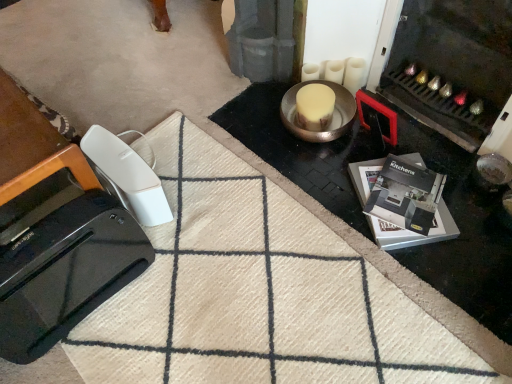
Question: Considering the relative sizes of beige woolen doormat at lower left and white plastic remote at lower left, marked as the second home appliance in a front-to-back arrangement, in the image provided, is beige woolen doormat at lower left smaller than white plastic remote at lower left, marked as the second home appliance in a front-to-back arrangement,?

Choices:
 (A) no
 (B) yes

Answer: (A)

Question: From a real-world perspective, is beige woolen doormat at lower left physically above white plastic remote at lower left, marked as the second home appliance in a front-to-back arrangement?

Choices:
 (A) no
 (B) yes

Answer: (A)

Question: From the image's perspective, is beige woolen doormat at lower left on top of white plastic remote at lower left, marked as the second home appliance in a front-to-back arrangement?

Choices:
 (A) yes
 (B) no

Answer: (B)

Question: From the image's perspective, is beige woolen doormat at lower left under white plastic remote at lower left, marked as the second home appliance in a front-to-back arrangement?

Choices:
 (A) yes
 (B) no

Answer: (A)

Question: Are beige woolen doormat at lower left and white plastic remote at lower left, the 1th home appliance from the back, far apart?

Choices:
 (A) yes
 (B) no

Answer: (B)

Question: Would you say beige woolen doormat at lower left is to the left or to the right of white plastic remote at lower left, the 1th home appliance from the back, in the picture?

Choices:
 (A) right
 (B) left

Answer: (A)

Question: Looking at the image, does beige woolen doormat at lower left seem bigger or smaller compared to white plastic remote at lower left, marked as the second home appliance in a front-to-back arrangement?

Choices:
 (A) small
 (B) big

Answer: (B)

Question: Relative to white plastic remote at lower left, the 1th home appliance from the back, is beige woolen doormat at lower left in front or behind?

Choices:
 (A) behind
 (B) front

Answer: (B)

Question: From the image's perspective, is beige woolen doormat at lower left located above or below white plastic remote at lower left, marked as the second home appliance in a front-to-back arrangement?

Choices:
 (A) above
 (B) below

Answer: (B)

Question: In the image, is black glossy toaster at lower left, the 1th home appliance from the front, positioned in front of or behind beige woolen doormat at lower left?

Choices:
 (A) behind
 (B) front

Answer: (A)

Question: Considering the positions of black glossy toaster at lower left, acting as the 2th home appliance starting from the back, and beige woolen doormat at lower left in the image, is black glossy toaster at lower left, acting as the 2th home appliance starting from the back, wider or thinner than beige woolen doormat at lower left?

Choices:
 (A) thin
 (B) wide

Answer: (A)

Question: From the image's perspective, is black glossy toaster at lower left, acting as the 2th home appliance starting from the back, located above or below beige woolen doormat at lower left?

Choices:
 (A) above
 (B) below

Answer: (A)

Question: From a real-world perspective, relative to beige woolen doormat at lower left, is black glossy toaster at lower left, the 1th home appliance from the front, vertically above or below?

Choices:
 (A) above
 (B) below

Answer: (A)

Question: Is black glossy toaster at lower left, the 1th home appliance from the front, wider or thinner than black glossy kitchens brochure at lower right?

Choices:
 (A) wide
 (B) thin

Answer: (B)

Question: Is black glossy toaster at lower left, acting as the 2th home appliance starting from the back, bigger or smaller than black glossy kitchens brochure at lower right?

Choices:
 (A) big
 (B) small

Answer: (A)